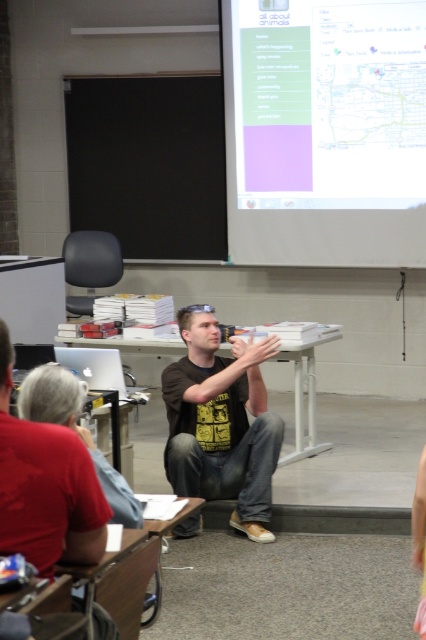
You are a student sitting at the back of the classroom. You want to see the white plastic table at center clearly. Is the red shirt at left blocking your view of it?

The red shirt at left is in front of the white plastic table at center, so it is blocking your view of the table.

You are a student sitting at the back of the classroom. You want to see both the matte black laptop at left and the red shirt at left clearly. Which object is closer to you, and why?

The matte black laptop at left is closer to you because it is positioned in front of the red shirt at left, meaning it is nearer to your viewpoint.